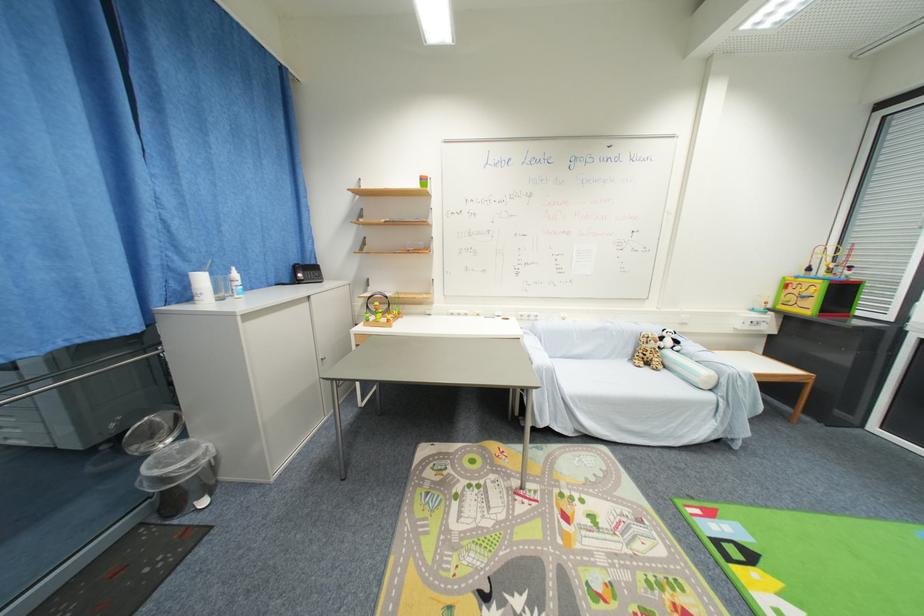
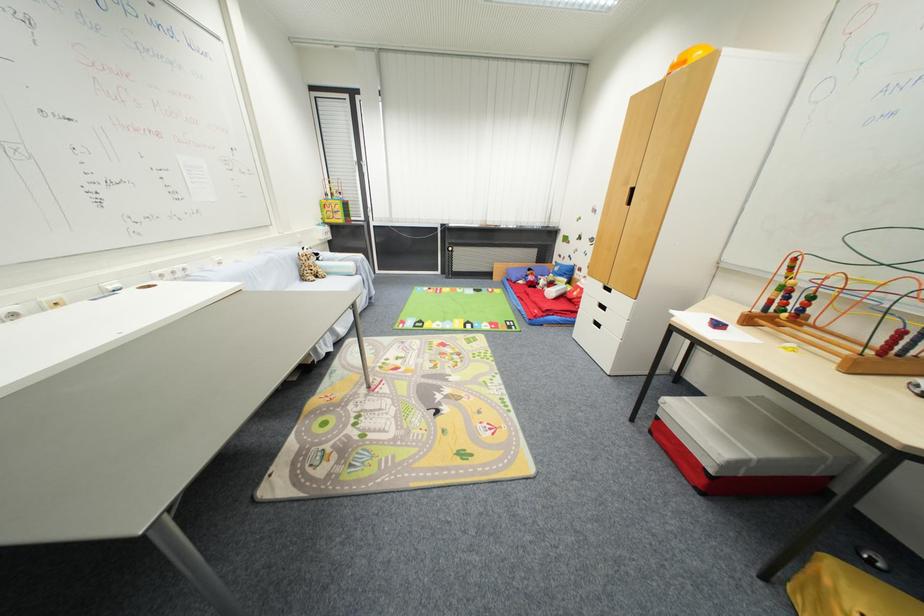
Find the pixel in the second image that matches pixel 650 358 in the first image.

(313, 274)